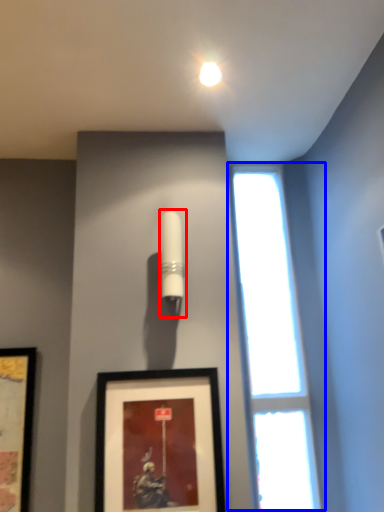
Question: Which of the following is the farthest to the observer, lamp (highlighted by a red box) or window (highlighted by a blue box)?

Choices:
 (A) lamp
 (B) window

Answer: (B)